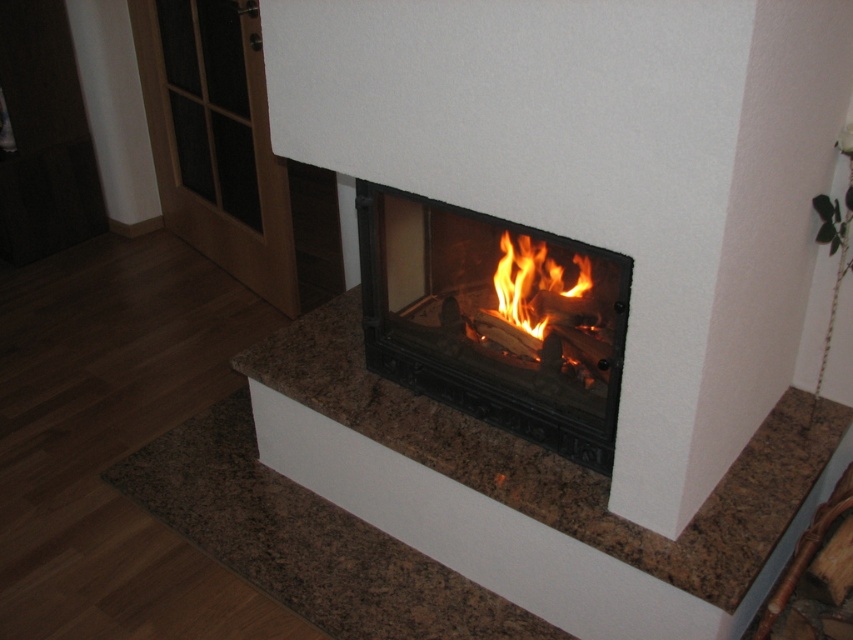
You are designing a living room layout and want to place a 2.5m tall floor lamp next to the fireplace. Given the height of the brown granite fireplace at center and the black glass fireplace at center, which fireplace would allow the floor lamp to stand without hitting the ceiling if the ceiling height is 2.8m?

The brown granite fireplace at center is much taller than the black glass fireplace at center. Since the ceiling height is 2.8m, the floor lamp at 2.5m would leave only 0.3m clearance. However, if the brown granite fireplace is taller, it might already occupy more vertical space. To ensure the floor lamp doesn

You are standing in the room and want to locate the brown granite fireplace at center. According to the coordinates provided, where would you find it?

The brown granite fireplace at center is located at point (527, 492).

You are standing in the living room and want to place a decorative item on the brown granite fireplace at center and the black glass fireplace at center. Which fireplace is located to the right side of the other?

The brown granite fireplace at center is positioned on the right side of black glass fireplace at center, so the brown granite fireplace at center is to the right of the black glass fireplace at center.